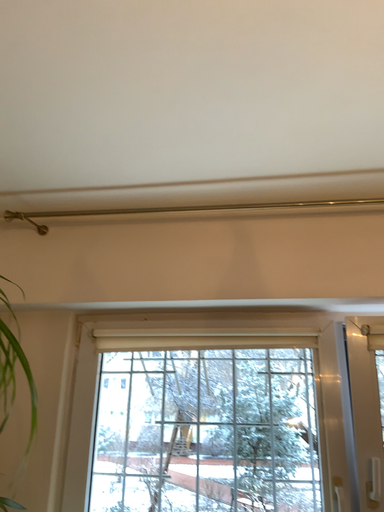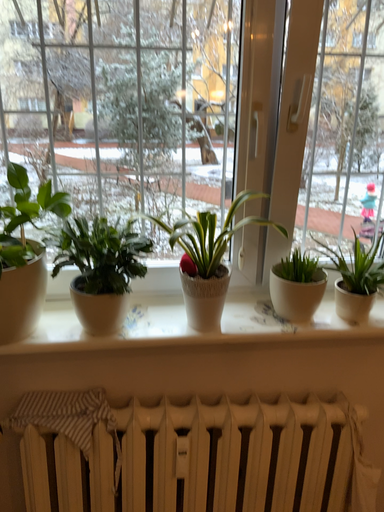
Question: How did the camera likely rotate when shooting the video?

Choices:
 (A) rotated right
 (B) rotated left

Answer: (A)